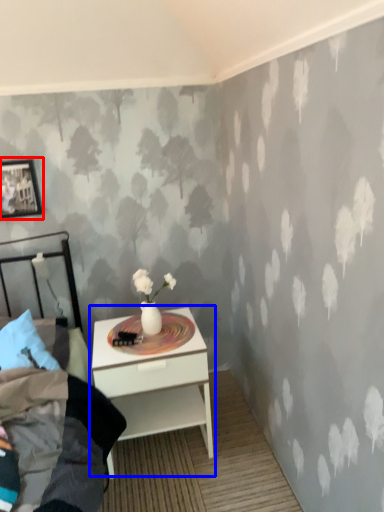
Question: Which point is closer to the camera, picture frame (highlighted by a red box) or nightstand (highlighted by a blue box)?

Choices:
 (A) picture frame
 (B) nightstand

Answer: (B)